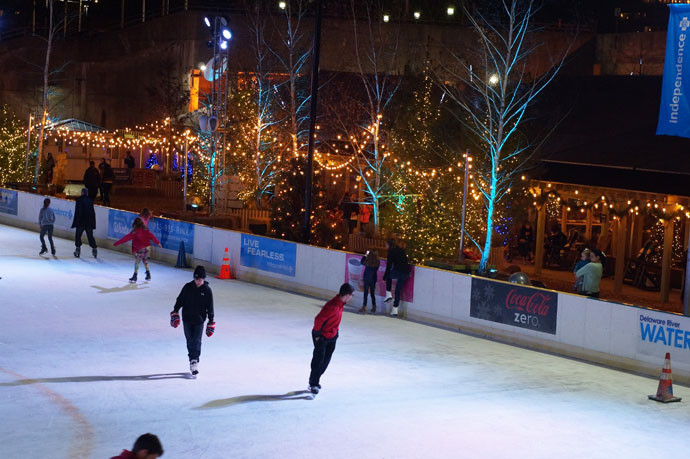
Identify the location of wall. The height and width of the screenshot is (459, 690). (435, 276).